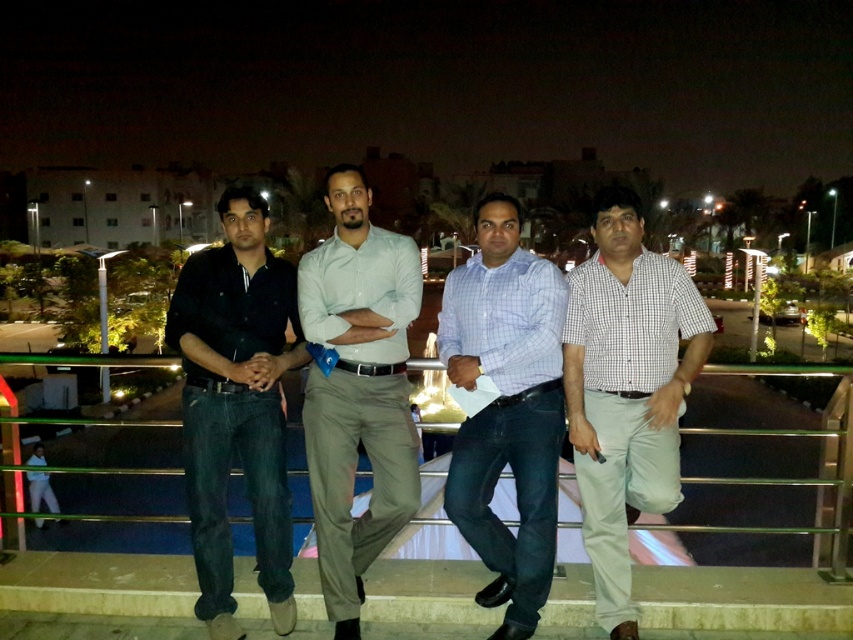
You are a photographer standing at the center of the bridge. You want to take a photo of the checkered fabric shirt at right. Which direction should you move to get a better shot?

You should move to the left to get a better shot of the checkered fabric shirt at right because it is located at point [625,388], which is to the right side of the image from your current position.

Looking at this image, you are standing at the point labeled point (608, 339) and want to take a photo of the four men on the bridge using a camera that has a maximum focus range of 3.5 meters. Will the camera be able to focus on the men?

The point labeled point (608, 339) and the camera are 3.48 meters apart, so yes, the camera can focus on the men because the distance is within the 3.5 meters maximum focus range.

You are a photographer trying to capture a group photo of the checkered fabric shirt at right and the light gray cotton pants at center. Since you want both subjects to be in focus, you need to ensure they are aligned properly. Based on their positions, which clothing item is located to the right of the other?

The checkered fabric shirt at right is positioned on the right side of the light gray cotton pants at center.